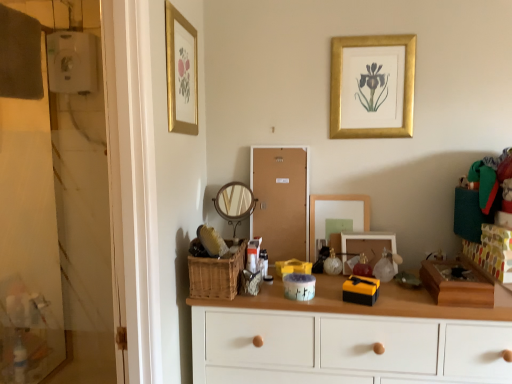
Locate an element on the screen. This screenshot has height=384, width=512. blank space situated above wooden box at right (from a real-world perspective) is located at coordinates (452, 272).